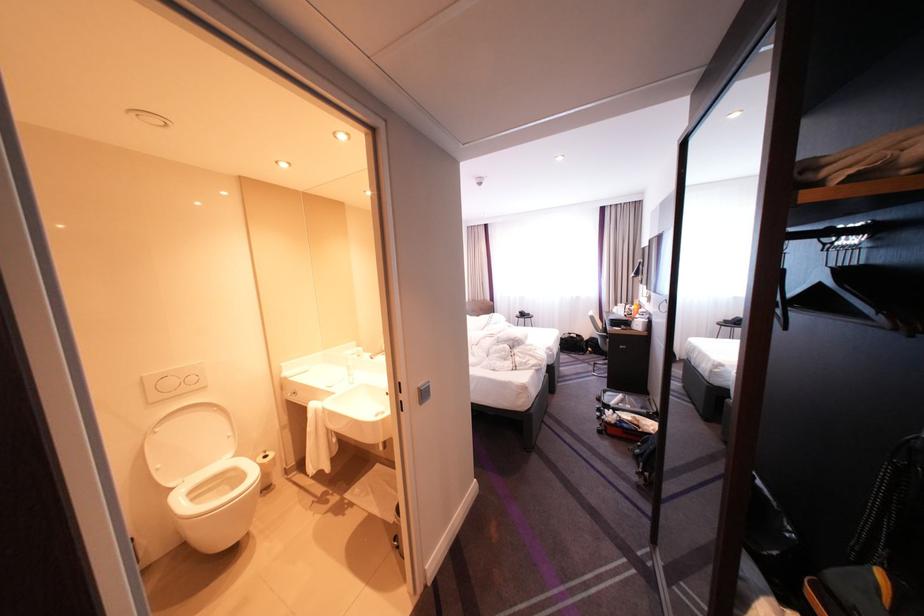
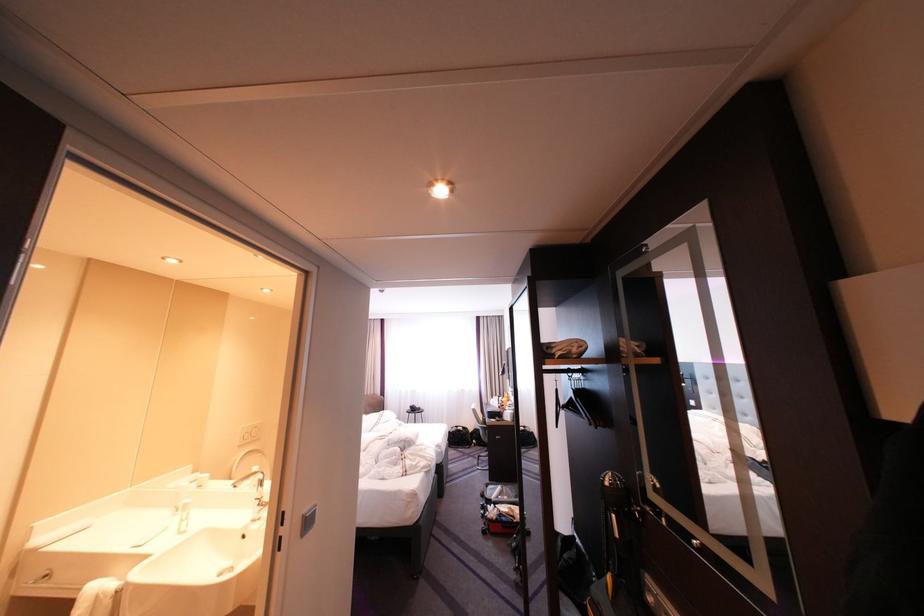
Where in the second image is the point corresponding to (x=383, y=355) from the first image?

(245, 483)